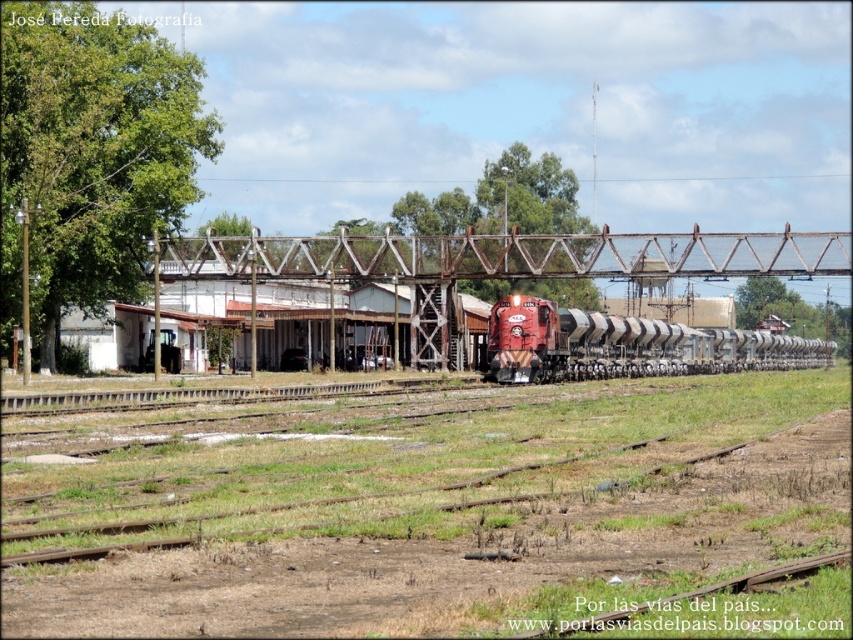
Based on the photo, between rusty metal bridge at center and matte red locomotive at center, which one is positioned higher?

Positioned higher is rusty metal bridge at center.

Identify the location of rusty metal bridge at center. The image size is (853, 640). coord(509,256).